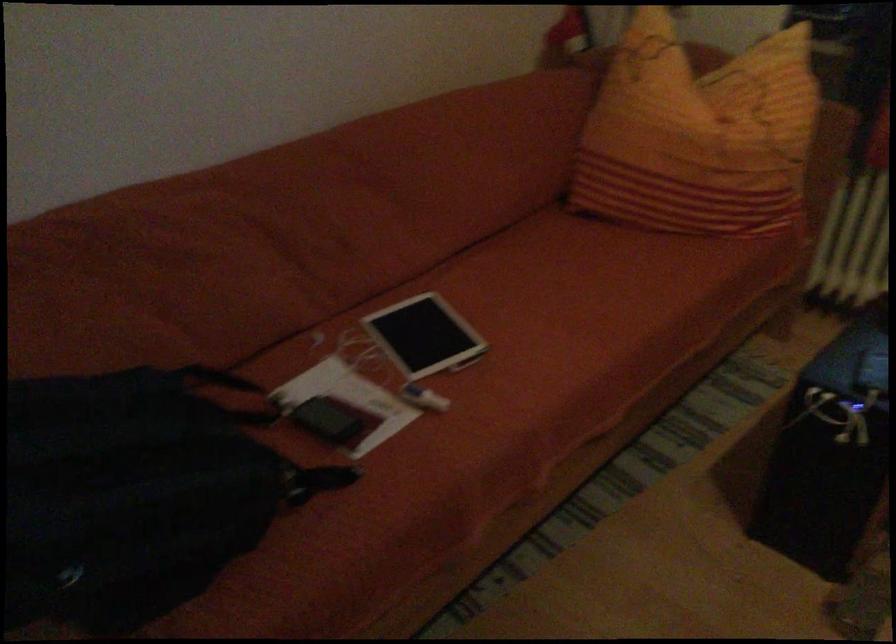
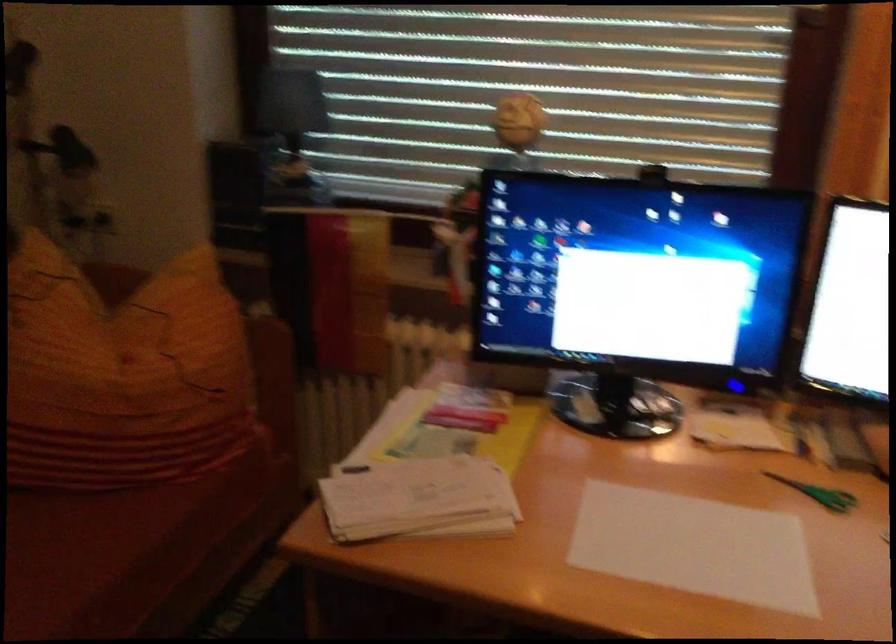
The point at [658,269] is marked in the first image. Where is the corresponding point in the second image?

(66, 556)